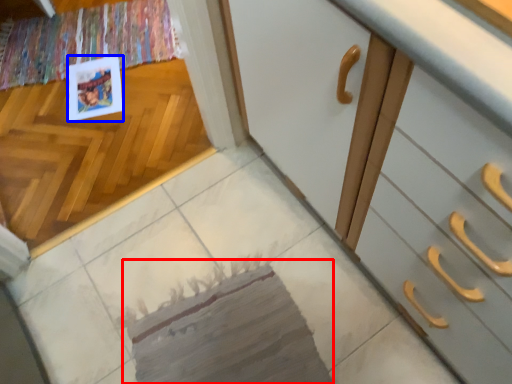
Question: Which object is further to the camera taking this photo, mat (highlighted by a red box) or postcard (highlighted by a blue box)?

Choices:
 (A) mat
 (B) postcard

Answer: (B)